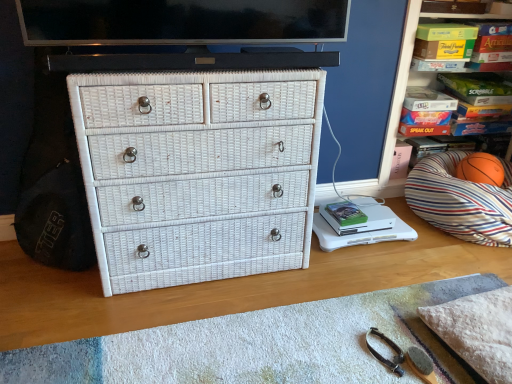
Question: From the image's perspective, is green matte book at center located above orange rubber basketball at right?

Choices:
 (A) no
 (B) yes

Answer: (A)

Question: Would you say green matte book at center contains orange rubber basketball at right?

Choices:
 (A) no
 (B) yes

Answer: (A)

Question: Can you confirm if green matte book at center is smaller than orange rubber basketball at right?

Choices:
 (A) yes
 (B) no

Answer: (A)

Question: Is green matte book at center thinner than orange rubber basketball at right?

Choices:
 (A) no
 (B) yes

Answer: (A)

Question: Is green matte book at center to the right of orange rubber basketball at right from the viewer's perspective?

Choices:
 (A) yes
 (B) no

Answer: (B)

Question: Is green matte book at center taller or shorter than white wicker chest of drawers at center?

Choices:
 (A) short
 (B) tall

Answer: (A)

Question: In the image, is green matte book at center on the left side or the right side of white wicker chest of drawers at center?

Choices:
 (A) right
 (B) left

Answer: (A)

Question: From the image's perspective, is green matte book at center above or below white wicker chest of drawers at center?

Choices:
 (A) below
 (B) above

Answer: (A)

Question: Considering their positions, is green matte book at center located in front of or behind white wicker chest of drawers at center?

Choices:
 (A) front
 (B) behind

Answer: (B)

Question: Looking at their shapes, would you say white wicker chest of drawers at center is wider or thinner than flat screen tv at upper center?

Choices:
 (A) thin
 (B) wide

Answer: (B)

Question: Would you say white wicker chest of drawers at center is inside or outside flat screen tv at upper center?

Choices:
 (A) outside
 (B) inside

Answer: (A)

Question: Would you say white wicker chest of drawers at center is to the left or to the right of flat screen tv at upper center in the picture?

Choices:
 (A) right
 (B) left

Answer: (B)

Question: From a real-world perspective, is white wicker chest of drawers at center physically located above or below flat screen tv at upper center?

Choices:
 (A) above
 (B) below

Answer: (B)

Question: Looking at their shapes, would you say flat screen tv at upper center is wider or thinner than white wicker drawer at center?

Choices:
 (A) wide
 (B) thin

Answer: (B)

Question: Which is correct: flat screen tv at upper center is inside white wicker drawer at center, or outside of it?

Choices:
 (A) outside
 (B) inside

Answer: (A)